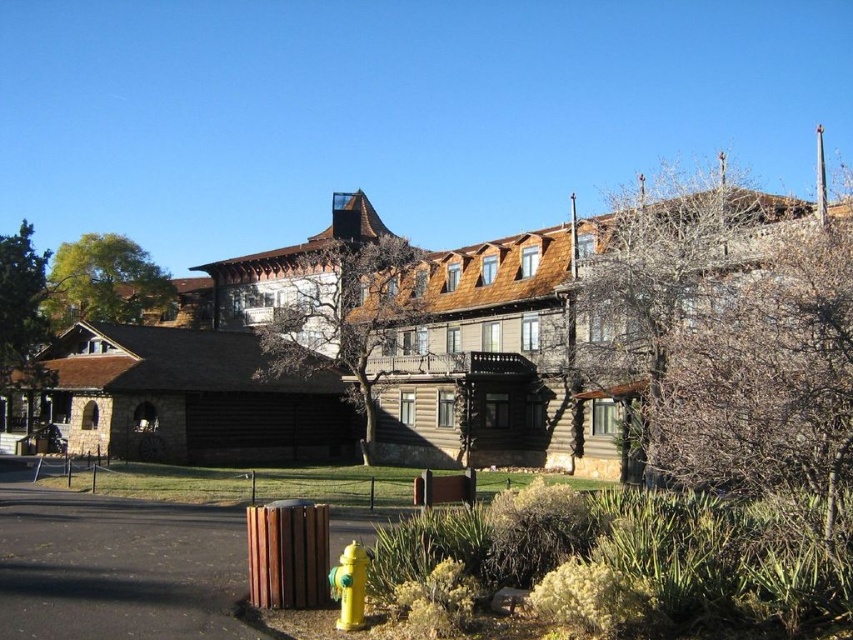
You are an architect planning to add a new structure near the brown wooden tree at upper center and the green leafy tree at upper left. Which tree has a narrower width, and therefore requires less space for construction planning?

The brown wooden tree at upper center has a narrower width compared to the green leafy tree at upper left, so it requires less space for construction planning.

You are standing in front of the building and want to take a photo that includes both the brown wooden tree at upper center and the yellow matte fire hydrant at lower center. Which object should you position closer to the camera to ensure both are in focus?

You should position the brown wooden tree at upper center closer to the camera because it is already further away than the yellow matte fire hydrant at lower center. This way, both will be at a similar distance from the camera and in focus.